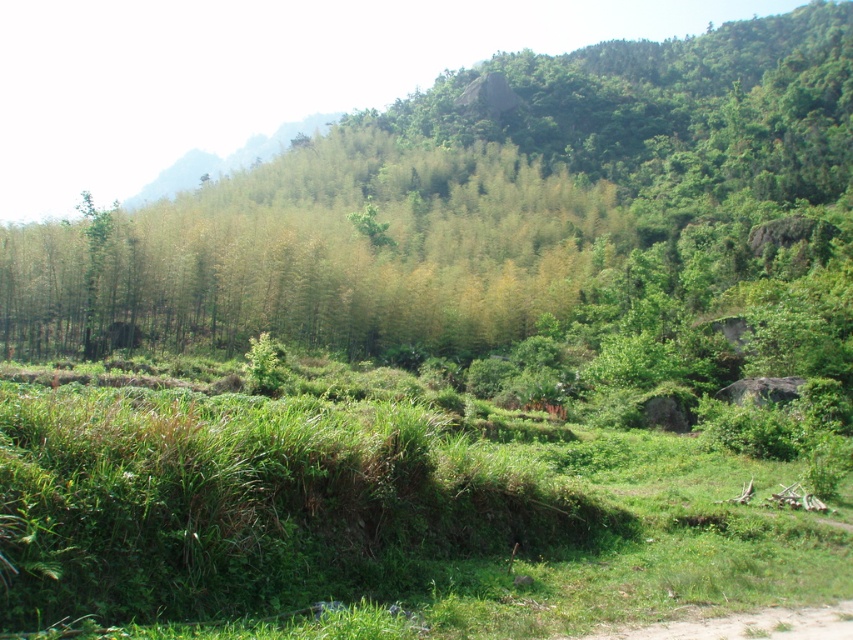
Question: Which object is farther from the camera taking this photo?

Choices:
 (A) green leafy tree at center
 (B) green leafy grass at lower left

Answer: (A)

Question: Is green leafy tree at center below green leafy grass at lower left?

Choices:
 (A) no
 (B) yes

Answer: (A)

Question: Is green leafy tree at center in front of green leafy grass at lower left?

Choices:
 (A) no
 (B) yes

Answer: (A)

Question: Which of the following is the closest to the observer?

Choices:
 (A) green leafy grass at lower left
 (B) green leafy tree at center

Answer: (A)

Question: Is green leafy tree at center further to the viewer compared to green leafy grass at lower left?

Choices:
 (A) no
 (B) yes

Answer: (B)